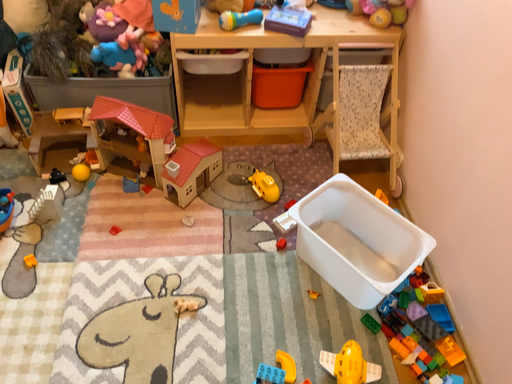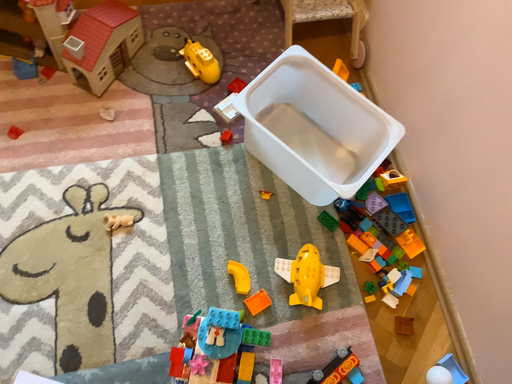
Question: How did the camera likely rotate when shooting the video?

Choices:
 (A) rotated left
 (B) rotated right

Answer: (B)